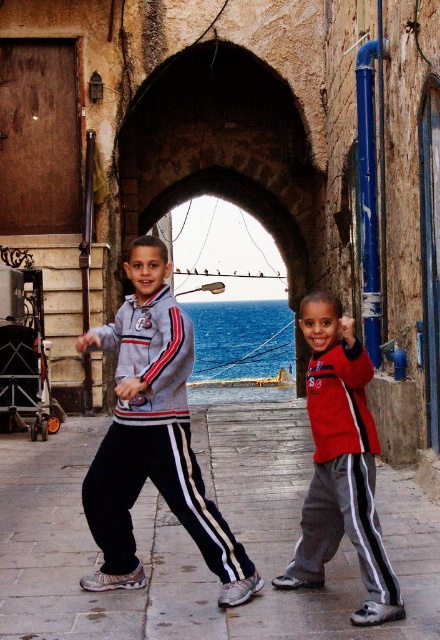
Question: Can you confirm if stone archway at center is positioned to the right of red matte jacket at center?

Choices:
 (A) no
 (B) yes

Answer: (A)

Question: Is stone archway at center below matte gray sweatshirt at left?

Choices:
 (A) no
 (B) yes

Answer: (A)

Question: Which object is the farthest from the black track pants at center?

Choices:
 (A) red matte jacket at center
 (B) stone archway at center

Answer: (B)

Question: Which point appears farthest from the camera in this image?

Choices:
 (A) (237, 58)
 (B) (116, 579)
 (C) (157, 365)
 (D) (69, 426)

Answer: (A)

Question: In this image, where is black track pants at center located relative to gray track suit at center?

Choices:
 (A) right
 (B) left

Answer: (A)

Question: Which of the following is the closest to the observer?

Choices:
 (A) black track pants at center
 (B) red matte jacket at center
 (C) gray track suit at center
 (D) matte gray sweatshirt at left

Answer: (B)